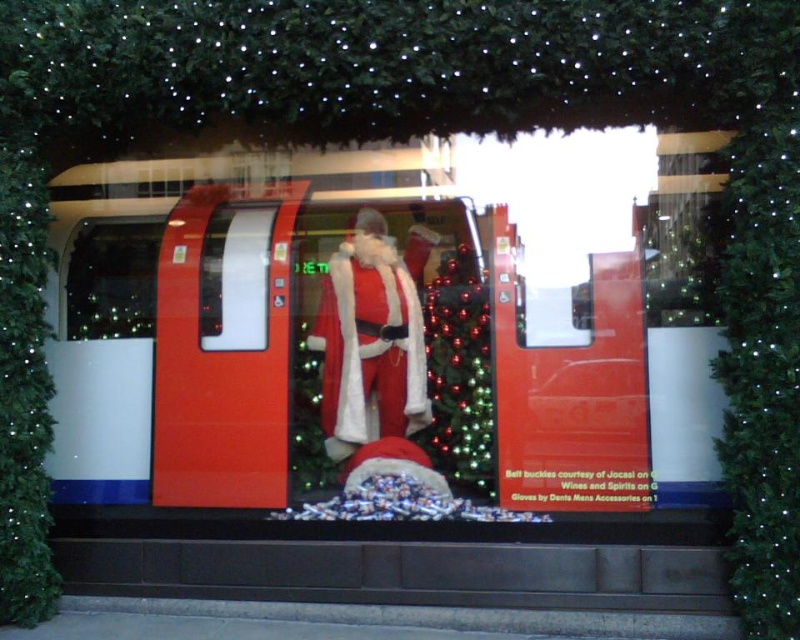
Question: Which object is positioned closest to the metallic red train at center?

Choices:
 (A) green matte lights at left
 (B) shiny red train at center

Answer: (A)

Question: Among these points, which one is farthest from the camera?

Choices:
 (A) (686, 145)
 (B) (108, 289)

Answer: (B)

Question: Which of the following is the farthest from the observer?

Choices:
 (A) metallic red train at center
 (B) green matte lights at left

Answer: (B)

Question: Can you confirm if shiny red train at center is bigger than white fur santa at center?

Choices:
 (A) yes
 (B) no

Answer: (A)

Question: Does green matte lights at left have a larger size compared to metallic red train at center?

Choices:
 (A) no
 (B) yes

Answer: (B)

Question: Is white fur santa at center wider than green matte lights at left?

Choices:
 (A) no
 (B) yes

Answer: (B)